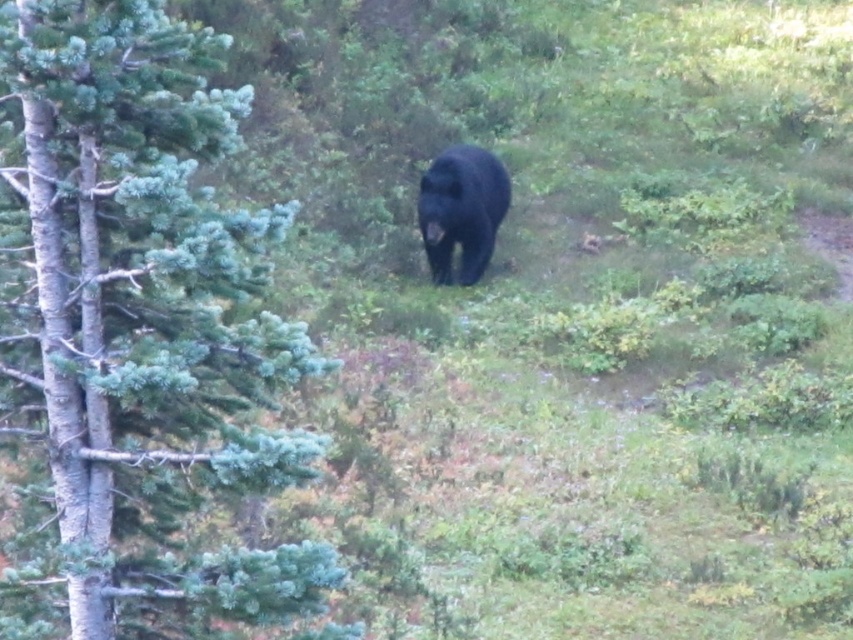
What do you see at coordinates (138, 330) in the screenshot? I see `green matte tree at center-left` at bounding box center [138, 330].

Does point (233, 387) come closer to viewer compared to point (495, 230)?

That is True.

This screenshot has width=853, height=640. What are the coordinates of `green matte tree at center-left` in the screenshot? It's located at (138, 330).